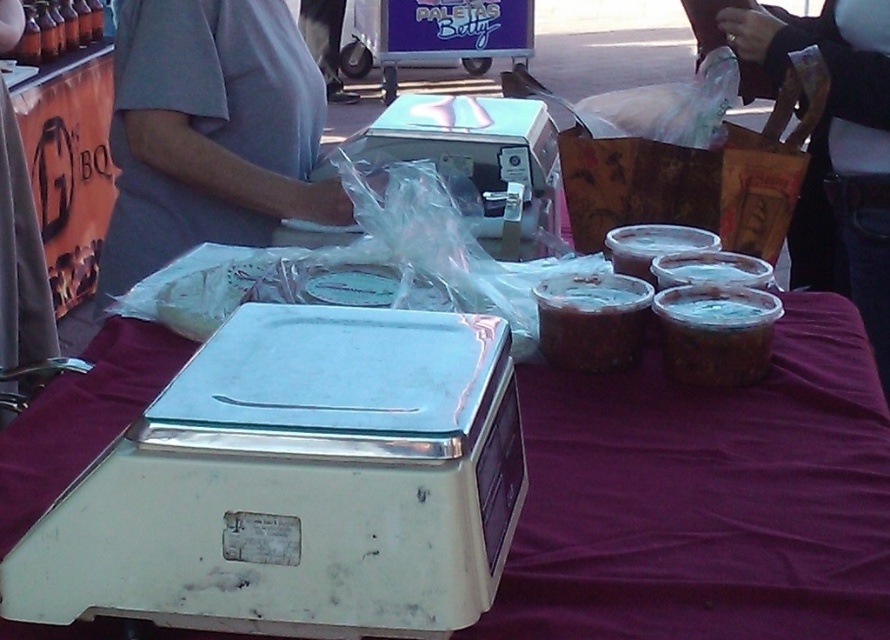
You are a vendor at the market and need to place a new item on the table. The purple fabric at center and brown matte jar at center are already there. Which object should you move to make space if you want to place the new item next to the wider object?

The purple fabric at center is wider than the brown matte jar at center, so you should move the brown matte jar at center to make space next to the wider purple fabric at center.

You are a delivery person who needs to pick up an item from a market stall. You are standing 1 meter away from the table. There is a point at coordinates point (811,493). Can you reach this point without moving closer to the table?

The distance of point (811,493) from the camera is 96.13 centimeters. Since you are standing 1 meter away from the table, which is 100 centimeters, you can reach the point without moving closer because the point is within your current reach distance.

What is located at the coordinates point (705, 499)?

The point (705, 499) corresponds to the purple fabric at center.